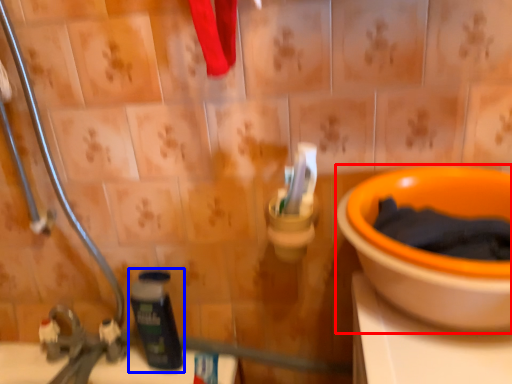
Question: Among these objects, which one is nearest to the camera, toilet (highlighted by a red box) or bottle (highlighted by a blue box)?

Choices:
 (A) toilet
 (B) bottle

Answer: (A)